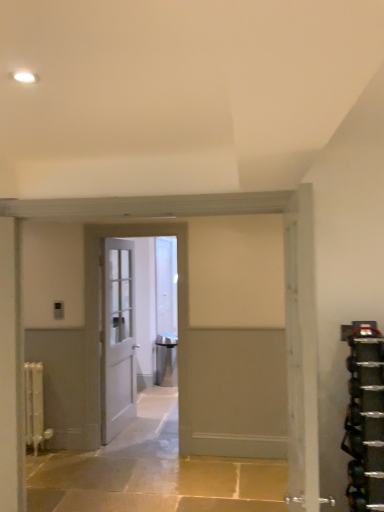
This screenshot has width=384, height=512. I want to click on vacant area on top of white wooden door at center, which ranks as the third door in right-to-left order (from a real-world perspective), so click(x=141, y=222).